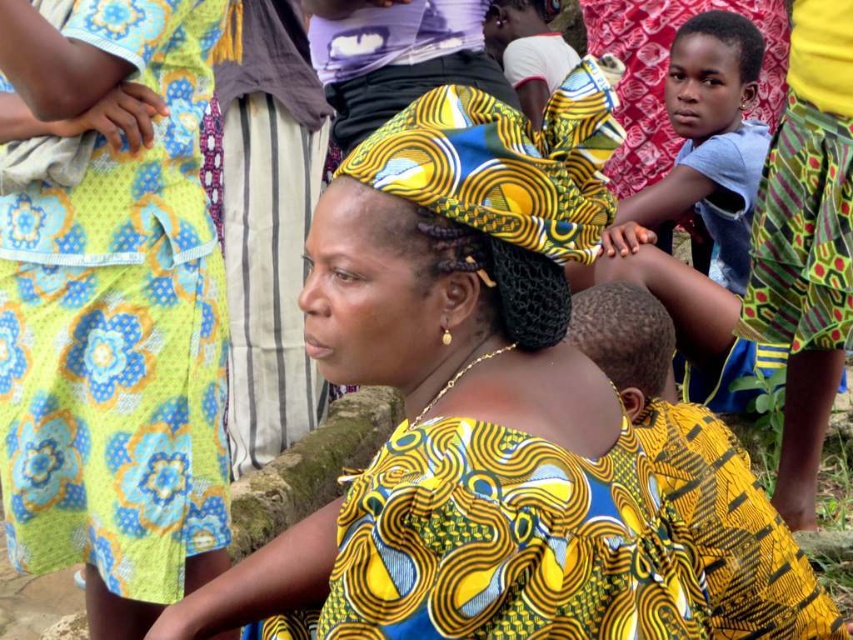
You are standing at the center of the image and want to locate the light blue cotton shirt at upper right. In which direction should you look to find it?

The light blue cotton shirt at upper right is located at point [711,140], which means you should look to the upper right direction to find it.

You are organizing a cultural exhibition and need to display two items from the image. The first is the yellow printed fabric at center, and the second is the light blue cotton shirt at upper right. Which item should be placed in a larger display case to accommodate its size?

The light blue cotton shirt at upper right requires a larger display case because it is bigger than the yellow printed fabric at center.

You are a photographer trying to capture a group photo of the light blue cotton shirt at upper right and the matte black head at upper center. Since you want both subjects to be in focus, you need to adjust your camera settings. Which subject should you focus on to ensure both are sharp?

The light blue cotton shirt at upper right is much taller than the matte black head at upper center, so focusing on the closer subject, the matte black head at upper center, will ensure both are in focus.